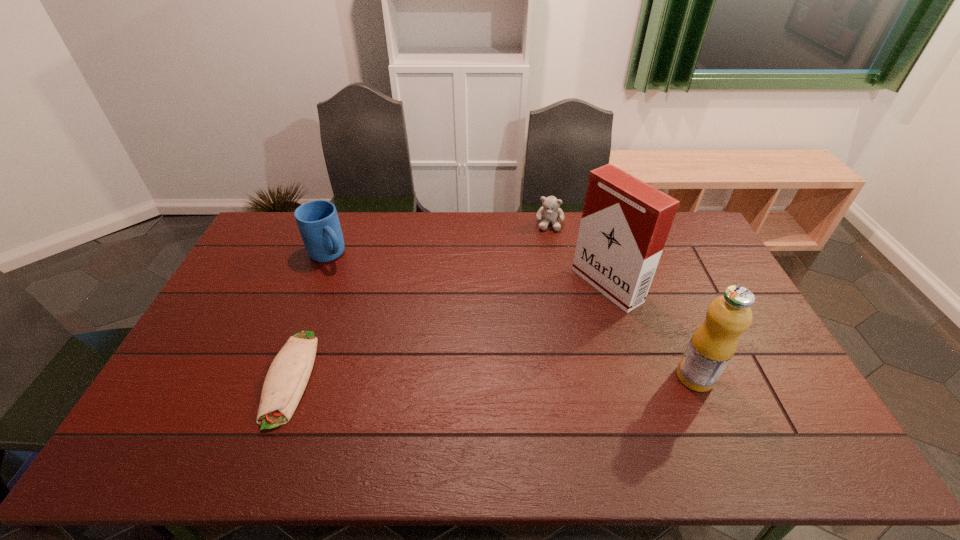
Image resolution: width=960 pixels, height=540 pixels. Find the location of `teddy bear that is at the far edge`. teddy bear that is at the far edge is located at coordinates (550, 212).

Where is `burrito at the near edge`? burrito at the near edge is located at coordinates [x=288, y=375].

Identify the location of fruit juice located at the near edge. [x=713, y=344].

Find the location of a particular element. The width and height of the screenshot is (960, 540). vacant space at the far edge of the desktop is located at coordinates (480, 212).

Find the location of `free location at the near edge of the desktop`. free location at the near edge of the desktop is located at coordinates (386, 401).

In the image, there is a desktop. What are the coordinates of `vacant space at the left edge` in the screenshot? It's located at (187, 363).

In the image, there is a desktop. Identify the location of vacant region at the right edge. The height and width of the screenshot is (540, 960). (697, 261).

Find the location of a particular element. vacant space at the near left corner of the desktop is located at coordinates (211, 420).

Locate an element on the screen. vacant space at the near right corner is located at coordinates (805, 406).

Locate an element on the screen. This screenshot has height=540, width=960. free spot between the mug and the fourth tallest object is located at coordinates (439, 239).